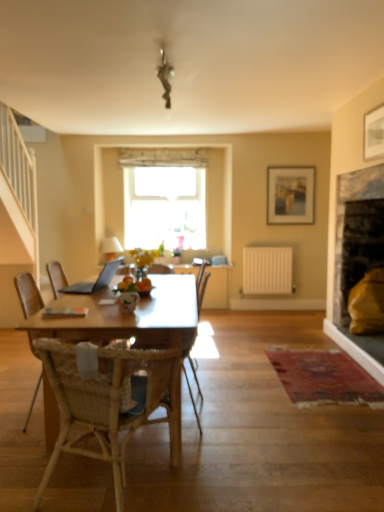
Find the location of `vacant space that's between woven wood chair at center, which ranks as the third chair in back-to-front order, and woven wood chair at center, acting as the second chair starting from the front`. vacant space that's between woven wood chair at center, which ranks as the third chair in back-to-front order, and woven wood chair at center, acting as the second chair starting from the front is located at coordinates (89, 477).